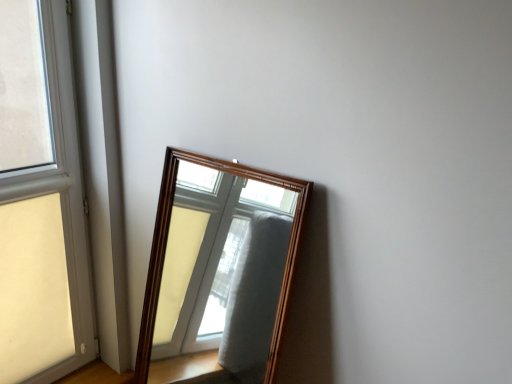
Describe the element at coordinates (41, 201) in the screenshot. I see `white plastic window at left` at that location.

The width and height of the screenshot is (512, 384). I want to click on white plastic window at left, so click(41, 201).

At what (x,y) coordinates should I click in order to perform the action: click on white plastic window at left. Please return your answer as a coordinate pair (x, y). The height and width of the screenshot is (384, 512). Looking at the image, I should click on (41, 201).